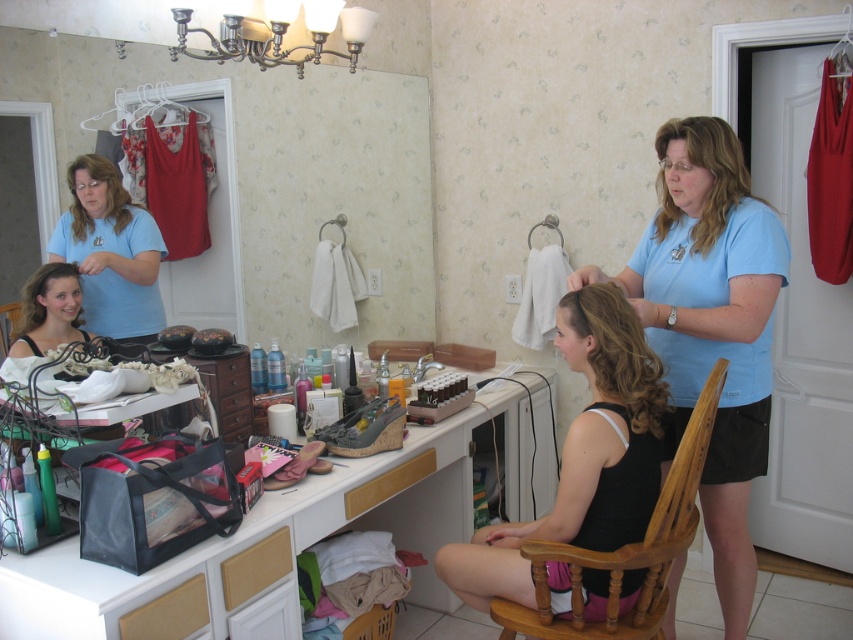
Question: Estimate the real-world distances between objects in this image. Which object is farther from the light blue t-shirt at upper right?

Choices:
 (A) translucent plastic bag at center
 (B) matte black hair at center
 (C) dark brown silky hair at center
 (D) black matte hair at center

Answer: (B)

Question: Can you confirm if translucent plastic bag at center is positioned to the right of black matte hair at center?

Choices:
 (A) yes
 (B) no

Answer: (B)

Question: Which point is farther from the camera taking this photo?

Choices:
 (A) (695, 257)
 (B) (48, 275)
 (C) (125, 189)

Answer: (C)

Question: Does light blue t-shirt at upper right have a larger size compared to dark brown silky hair at center?

Choices:
 (A) yes
 (B) no

Answer: (A)

Question: Which of the following is the closest to the observer?

Choices:
 (A) translucent plastic bag at center
 (B) matte blue shirt at center

Answer: (A)

Question: Can you confirm if black matte hair at center is positioned above dark brown silky hair at center?

Choices:
 (A) yes
 (B) no

Answer: (B)